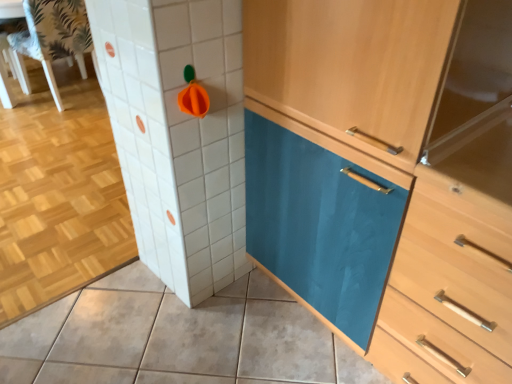
Question: Is light wood/wooden chest of drawers at center in front of or behind matte ceramic tile at lower center in the image?

Choices:
 (A) front
 (B) behind

Answer: (A)

Question: Considering the positions of light wood/wooden chest of drawers at center and matte ceramic tile at lower center in the image, is light wood/wooden chest of drawers at center taller or shorter than matte ceramic tile at lower center?

Choices:
 (A) tall
 (B) short

Answer: (A)

Question: Which of these objects is positioned closest to the light wood/wooden chest of drawers at center?

Choices:
 (A) teal glossy cabinet at center
 (B) white fabric chair at upper left
 (C) matte ceramic tile at lower center

Answer: (A)

Question: Which is nearer to the matte ceramic tile at lower center?

Choices:
 (A) white fabric chair at upper left
 (B) light wood/wooden chest of drawers at center
 (C) teal glossy cabinet at center

Answer: (B)